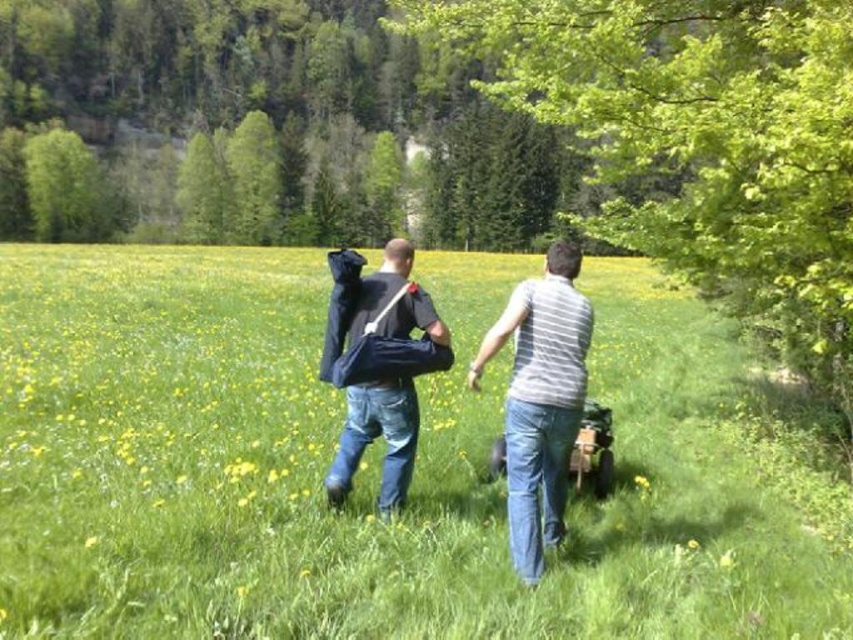
Question: Is denim jeans at center behind striped cotton shirt at center?

Choices:
 (A) no
 (B) yes

Answer: (A)

Question: Among these points, which one is farthest from the camera?

Choices:
 (A) (634, 477)
 (B) (582, 330)
 (C) (679, 140)
 (D) (698, 340)

Answer: (D)

Question: Which of the following is the farthest from the observer?

Choices:
 (A) green grass at center
 (B) dark blue fabric bag at center
 (C) striped cotton shirt at center
 (D) denim jeans at center

Answer: (B)

Question: Can you confirm if green grass at center is wider than green leafy tree at upper right?

Choices:
 (A) yes
 (B) no

Answer: (A)

Question: Is the position of striped cotton shirt at center less distant than that of yellow soft grass at center?

Choices:
 (A) yes
 (B) no

Answer: (A)

Question: Among these points, which one is farthest from the camera?

Choices:
 (A) (344, 372)
 (B) (225, 348)
 (C) (791, 88)

Answer: (B)